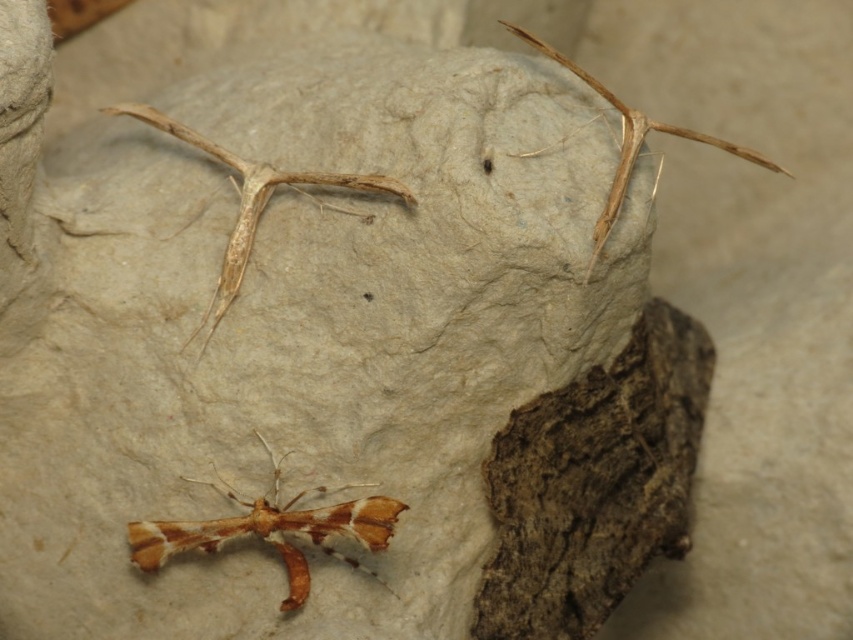
You are standing at the origin point of the image. There is a translucent beige moth at upper center located at point (252, 202). If you move 0.1 units to the right along the x axis, will you be closer to the translucent beige moth at upper center?

Moving 0.1 units to the right along the x axis from the origin point would increase your x coordinate from 0 to 0.1. The translucent beige moth at upper center is located at x coordinate 0.316. Since 0.1 is closer to 0.316 than 0 is, you would be closer to the translucent beige moth at upper center after moving.

You are a researcher studying insect behavior. You need to place a 10 inch ruler between the translucent beige moth at upper center and the brown matte insect at upper right. Will the ruler fit entirely between them without overlapping either insect?

The distance between the translucent beige moth at upper center and the brown matte insect at upper right is 8.59 inches. Since the ruler is 10 inches long, it will not fit entirely between them without overlapping either insect.